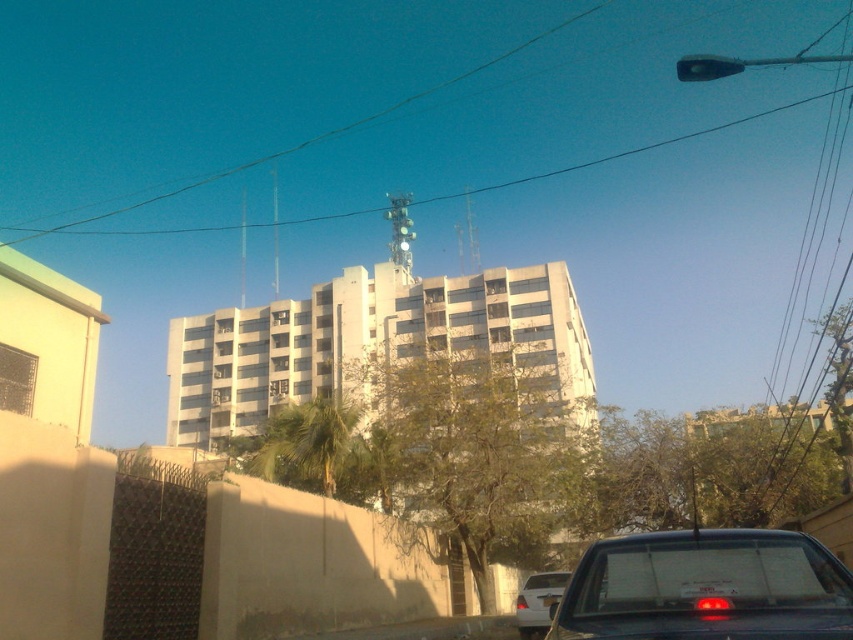
Question: Is black wire at upper center to the left of white plastic license plate at center from the viewer's perspective?

Choices:
 (A) yes
 (B) no

Answer: (A)

Question: Which object is the closest to the white matte car at lower right?

Choices:
 (A) black wire at upper center
 (B) white plastic license plate at center
 (C) metallic gray sedan at lower right
 (D) transparent glass traffic light at center

Answer: (C)

Question: Which of the following is the farthest from the observer?

Choices:
 (A) (680, 589)
 (B) (126, 205)
 (C) (404, 240)

Answer: (B)

Question: Which point appears farthest from the camera in this image?

Choices:
 (A) (392, 198)
 (B) (688, 589)
 (C) (540, 627)

Answer: (A)

Question: From the image, what is the correct spatial relationship of white matte car at lower right in relation to transparent glass traffic light at center?

Choices:
 (A) left
 (B) right

Answer: (B)

Question: Is white matte car at lower right below transparent glass traffic light at center?

Choices:
 (A) no
 (B) yes

Answer: (B)